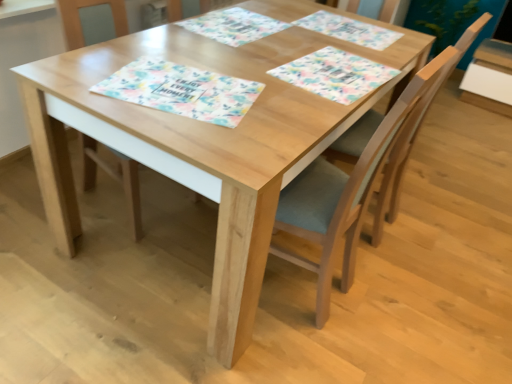
This screenshot has width=512, height=384. I want to click on free spot behind floral paper placemat at center, the first place mat viewed from the front, so click(209, 51).